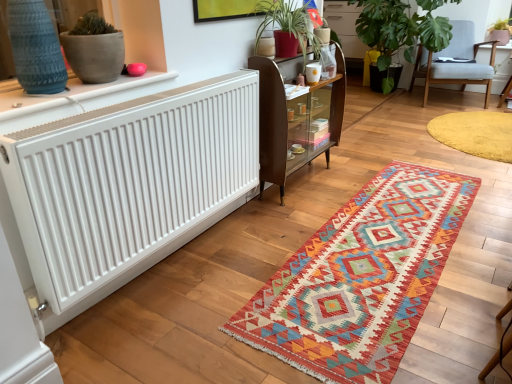
Question: Is green leafy plant at upper right, the 1th houseplant when ordered from left to right, completely or partially inside knitted woolen rug at center, which ranks as the first mat in front-to-back order?

Choices:
 (A) no
 (B) yes

Answer: (A)

Question: Considering the relative sizes of knitted woolen rug at center, placed as the 2th mat when sorted from back to front, and green leafy plant at upper right, the 2th houseplant when ordered from right to left, in the image provided, is knitted woolen rug at center, placed as the 2th mat when sorted from back to front, taller than green leafy plant at upper right, the 2th houseplant when ordered from right to left,?

Choices:
 (A) no
 (B) yes

Answer: (A)

Question: Is knitted woolen rug at center, the second mat when ordered from right to left, closer to the viewer compared to green leafy plant at upper right, the 1th houseplant when ordered from left to right?

Choices:
 (A) yes
 (B) no

Answer: (A)

Question: Can you confirm if knitted woolen rug at center, the second mat when ordered from right to left, is shorter than green leafy plant at upper right, the 1th houseplant when ordered from left to right?

Choices:
 (A) yes
 (B) no

Answer: (A)

Question: Considering the relative sizes of knitted woolen rug at center, placed as the 2th mat when sorted from back to front, and green leafy plant at upper right, the 2th houseplant when ordered from right to left, in the image provided, is knitted woolen rug at center, placed as the 2th mat when sorted from back to front, wider than green leafy plant at upper right, the 2th houseplant when ordered from right to left,?

Choices:
 (A) yes
 (B) no

Answer: (B)

Question: In terms of height, does knitted woolen rug at center, which ranks as the first mat in front-to-back order, look taller or shorter compared to green leafy plant at upper right, the 2th houseplant when ordered from right to left?

Choices:
 (A) tall
 (B) short

Answer: (B)

Question: From the image's perspective, is knitted woolen rug at center, placed as the 2th mat when sorted from back to front, positioned above or below green leafy plant at upper right, the 1th houseplant when ordered from left to right?

Choices:
 (A) above
 (B) below

Answer: (B)

Question: Is point (308, 332) positioned closer to the camera than point (401, 21)?

Choices:
 (A) closer
 (B) farther

Answer: (A)

Question: Based on their sizes in the image, would you say knitted woolen rug at center, which is the 1th mat in left-to-right order, is bigger or smaller than green leafy plant at upper right, the 2th houseplant when ordered from right to left?

Choices:
 (A) small
 (B) big

Answer: (A)

Question: Is white matte radiator at left inside the boundaries of wooden glass-fronted cabinet at center, or outside?

Choices:
 (A) outside
 (B) inside

Answer: (A)

Question: From their relative heights in the image, would you say white matte radiator at left is taller or shorter than wooden glass-fronted cabinet at center?

Choices:
 (A) short
 (B) tall

Answer: (A)

Question: Considering the relative positions of white matte radiator at left and wooden glass-fronted cabinet at center in the image provided, is white matte radiator at left to the left or to the right of wooden glass-fronted cabinet at center?

Choices:
 (A) right
 (B) left

Answer: (B)

Question: From the image's perspective, is white matte radiator at left above or below wooden glass-fronted cabinet at center?

Choices:
 (A) below
 (B) above

Answer: (A)

Question: In the image, is yellow plush rug at lower right, which is the 2th mat from bottom to top, on the left side or the right side of wooden glass-fronted cabinet at center?

Choices:
 (A) left
 (B) right

Answer: (B)

Question: Does point (488, 139) appear closer or farther from the camera than point (302, 132)?

Choices:
 (A) closer
 (B) farther

Answer: (B)